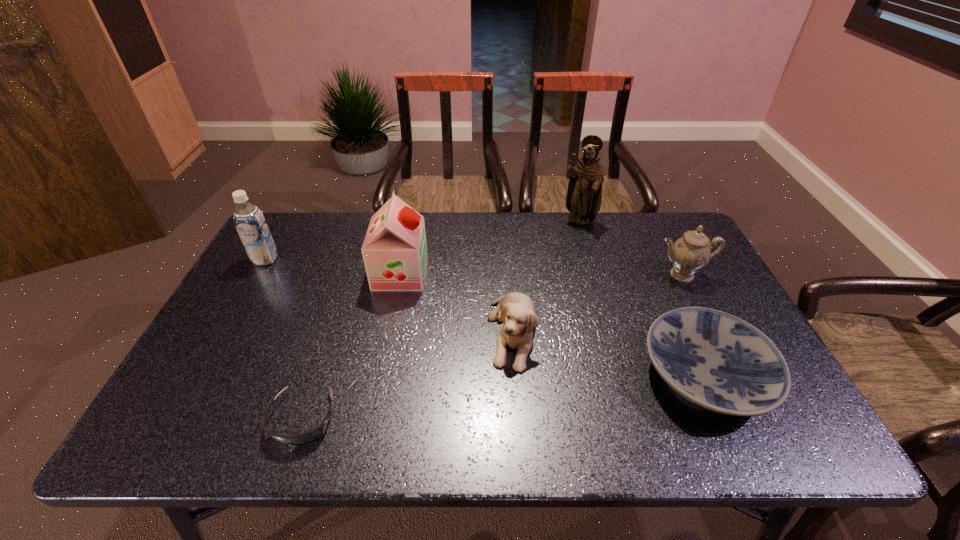
What are the coordinates of `unoccupied area between the left soya milk and the sixth tallest object` in the screenshot? It's located at (486, 317).

This screenshot has height=540, width=960. Find the location of `vacant point located between the farthest object and the sixth tallest object`. vacant point located between the farthest object and the sixth tallest object is located at coordinates (642, 299).

I want to click on empty space between the third object from left to right and the leftmost object, so click(x=333, y=266).

The height and width of the screenshot is (540, 960). What are the coordinates of `free space between the goggles and the figurine` in the screenshot? It's located at (441, 320).

I want to click on free spot between the fourth object from left to right and the tallest object, so click(545, 277).

The width and height of the screenshot is (960, 540). Find the location of `vacant region between the fifth object from right to left and the leftmost object`. vacant region between the fifth object from right to left and the leftmost object is located at coordinates (333, 266).

Locate an element on the screen. This screenshot has height=540, width=960. vacant area that lies between the fourth object from left to right and the plate is located at coordinates (609, 354).

This screenshot has height=540, width=960. I want to click on vacant point located between the fourth object from right to left and the leftmost object, so (389, 296).

Find the location of `free space between the chinaware and the fifth object from right to left`. free space between the chinaware and the fifth object from right to left is located at coordinates (541, 274).

Image resolution: width=960 pixels, height=540 pixels. Identify the location of vacant area that lies between the goggles and the plate. (504, 397).